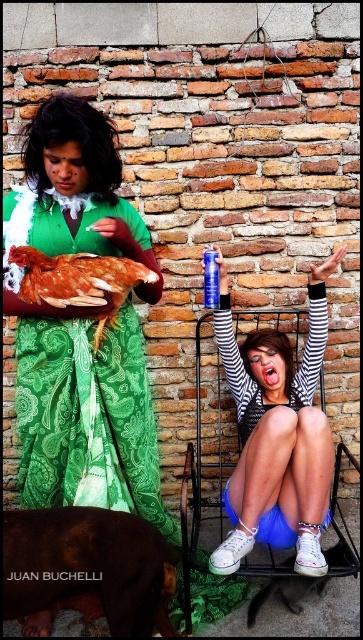
You are a fashion designer observing two dresses in an image. The green paisley dress at left and the striped fabric dress at center. Which dress has a wider width?

The green paisley dress at left has a larger width than the striped fabric dress at center according to the description.

You are a fashion designer observing the scene. You need to determine the placement of the striped fabric dress at center and the brown feathered chicken at center for a photoshoot. Which one is positioned higher in the frame?

The brown feathered chicken at center is positioned higher in the frame than the striped fabric dress at center because the striped fabric dress at center is located below it.

You are standing in front of the scene and want to know which of the two points, point [58,205] or point [38,268], is closer to you. Based on the description, which point is closer?

Point [38,268] is closer to you because it is less further to the camera than point [58,205].